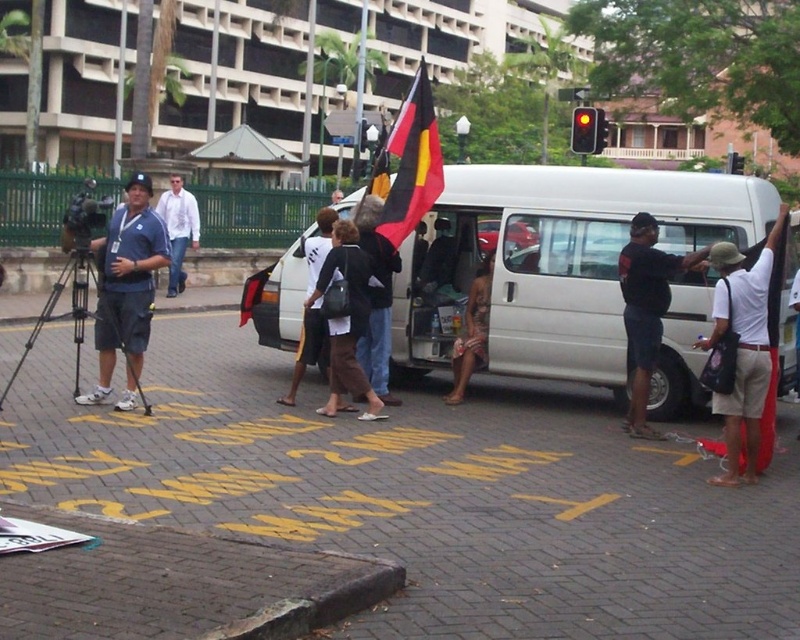
Question: Can you confirm if white cotton shirt at right is positioned below black and yellow fabric flag at center?

Choices:
 (A) no
 (B) yes

Answer: (B)

Question: Which point appears farthest from the camera in this image?

Choices:
 (A) (742, 460)
 (B) (334, 221)

Answer: (B)

Question: Which object is the farthest from the black fabric flag at center?

Choices:
 (A) brown leather sandals at center
 (B) white matte van at center

Answer: (B)

Question: Which of these objects is positioned farthest from the brown fabric pants at center?

Choices:
 (A) black and yellow fabric flag at center
 (B) black plastic video camera at left
 (C) brown leather sandals at center
 (D) black fabric bag at center

Answer: (B)

Question: Does black fabric bag at center appear on the left side of yellow fabric flag at center?

Choices:
 (A) no
 (B) yes

Answer: (B)

Question: In this image, where is black fabric bag at center located relative to brown leather sandals at center?

Choices:
 (A) left
 (B) right

Answer: (A)